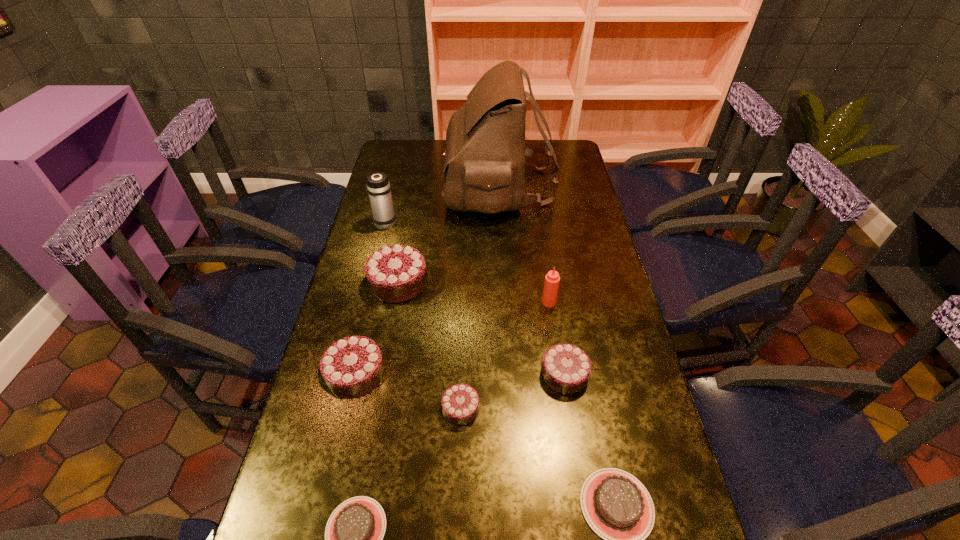
Find the location of a particular element. the fifth closest object relative to the third smallest chocolate chocolate cake is located at coordinates (487, 539).

Find the location of a particular element. Image resolution: width=960 pixels, height=540 pixels. the second closest chocolate cake to the fifth shortest chocolate cake is located at coordinates (487, 539).

At what (x,y) coordinates should I click in order to perform the action: click on chocolate cake object that ranks as the fifth closest to the fifth tallest object. Please return your answer as a coordinate pair (x, y). Looking at the image, I should click on (590, 539).

Where is `the fourth closest chocolate chocolate cake to the thermos bottle`? the fourth closest chocolate chocolate cake to the thermos bottle is located at coordinates (487, 539).

Where is `chocolate chocolate cake identified as the closest to the fifth shortest object`? Image resolution: width=960 pixels, height=540 pixels. chocolate chocolate cake identified as the closest to the fifth shortest object is located at coordinates (481, 481).

Locate an element on the screen. brown chocolate cake that stands as the second closest to the third chocolate chocolate cake from left to right is located at coordinates (590, 539).

Locate an element on the screen. the second closest brown chocolate cake to the fourth shortest object is located at coordinates (370, 539).

Identify the location of vacant space that satisfies the following two spatial constraints: 1. on the back side of the third chocolate chocolate cake from left to right; 2. on the right side of the rightmost chocolate chocolate cake. The height and width of the screenshot is (540, 960). (462, 374).

At what (x,y) coordinates should I click in order to perform the action: click on vacant space that satisfies the following two spatial constraints: 1. on the front side of the third biggest chocolate chocolate cake; 2. on the right side of the second biggest chocolate chocolate cake. Please return your answer as a coordinate pair (x, y). The image size is (960, 540). Looking at the image, I should click on 356,374.